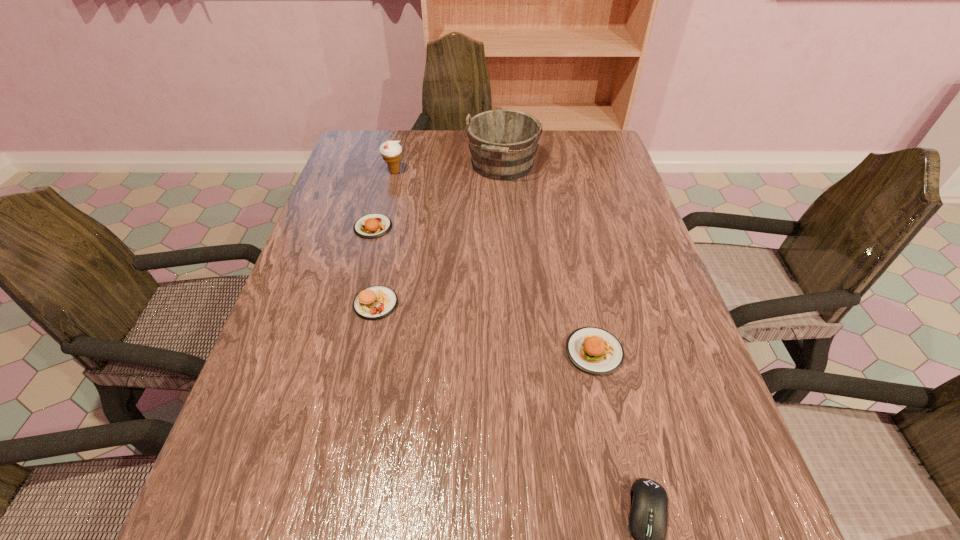
At what (x,y) coordinates should I click in order to perform the action: click on wine bucket. Please return your answer as a coordinate pair (x, y). Image resolution: width=960 pixels, height=540 pixels. Looking at the image, I should click on (503, 143).

The image size is (960, 540). I want to click on icecream, so click(x=391, y=151).

In order to click on the fourth farthest object in this screenshot , I will do `click(376, 302)`.

Locate an element on the screen. the tallest patty (food) is located at coordinates (376, 302).

The height and width of the screenshot is (540, 960). I want to click on the rightmost patty (food), so click(x=594, y=350).

This screenshot has height=540, width=960. Identify the location of the third shortest object. (594, 350).

Locate an element on the screen. the shortest patty (food) is located at coordinates (370, 226).

Locate an element on the screen. This screenshot has height=540, width=960. the farthest patty (food) is located at coordinates (370, 226).

The image size is (960, 540). I want to click on vacant area situated 0.380m on the left of the wine bucket, so click(341, 165).

This screenshot has width=960, height=540. Identify the location of vacant space located 0.180m on the right of the fifth shortest object. (465, 172).